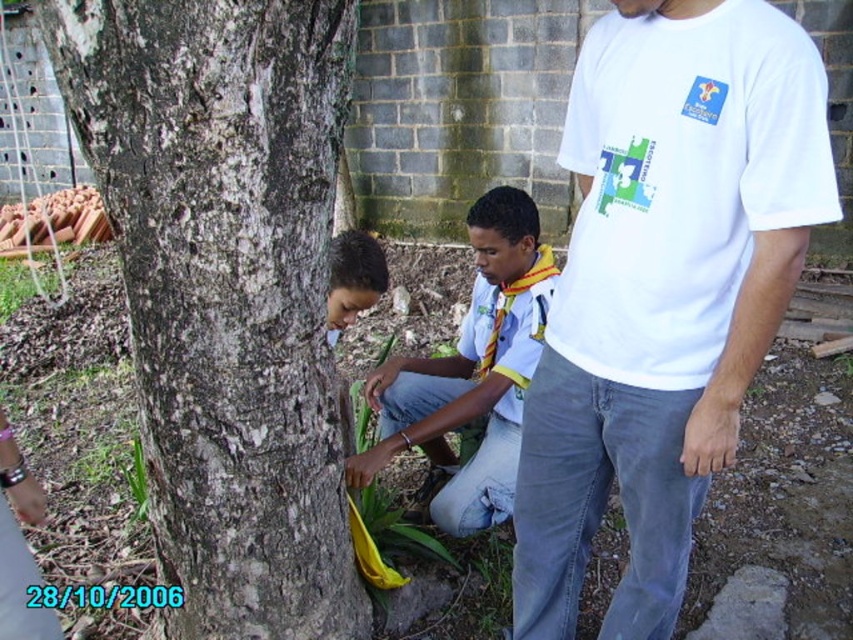
Question: Estimate the real-world distances between objects in this image. Which object is closer to the yellow fabric at center?

Choices:
 (A) smooth brown hair at lower center
 (B) rough bark tree at center
 (C) white cotton t-shirt at right

Answer: (A)

Question: Is rough bark tree at center to the left of yellow fabric at center from the viewer's perspective?

Choices:
 (A) yes
 (B) no

Answer: (A)

Question: Which object is closer to the camera taking this photo?

Choices:
 (A) yellow fabric at center
 (B) smooth brown hair at lower center
 (C) rough bark tree at center

Answer: (C)

Question: Can you confirm if rough bark tree at center is thinner than white cotton t-shirt at right?

Choices:
 (A) yes
 (B) no

Answer: (B)

Question: Does yellow fabric at center have a smaller size compared to smooth brown hair at lower center?

Choices:
 (A) no
 (B) yes

Answer: (A)

Question: Considering the real-world distances, which object is closest to the yellow fabric at center?

Choices:
 (A) white cotton t-shirt at right
 (B) smooth brown hair at lower center

Answer: (B)